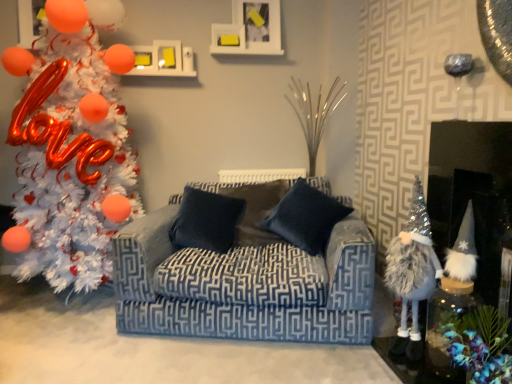
Question: Does dark blue fabric pillow at center, positioned as the 2th pillow in left-to-right order, have a greater width compared to dark blue fabric pillow at center, the second pillow viewed from the right?

Choices:
 (A) no
 (B) yes

Answer: (B)

Question: Is dark blue fabric pillow at center, the second pillow viewed from the right, located within dark blue fabric pillow at center, positioned as the 2th pillow in left-to-right order?

Choices:
 (A) no
 (B) yes

Answer: (A)

Question: Can you see dark blue fabric pillow at center, positioned as the 2th pillow in left-to-right order, touching dark blue fabric pillow at center, marked as the first pillow in a left-to-right arrangement?

Choices:
 (A) no
 (B) yes

Answer: (A)

Question: From the image's perspective, is dark blue fabric pillow at center, which appears as the 1th pillow when viewed from the right, under dark blue fabric pillow at center, the second pillow viewed from the right?

Choices:
 (A) yes
 (B) no

Answer: (B)

Question: Considering the relative sizes of dark blue fabric pillow at center, which appears as the 1th pillow when viewed from the right, and dark blue fabric pillow at center, the second pillow viewed from the right, in the image provided, is dark blue fabric pillow at center, which appears as the 1th pillow when viewed from the right, thinner than dark blue fabric pillow at center, the second pillow viewed from the right,?

Choices:
 (A) no
 (B) yes

Answer: (A)

Question: Is dark blue fabric pillow at center, positioned as the 2th pillow in left-to-right order, wider or thinner than white fluffy gnome at lower right?

Choices:
 (A) thin
 (B) wide

Answer: (A)

Question: Is dark blue fabric pillow at center, which appears as the 1th pillow when viewed from the right, inside the boundaries of white fluffy gnome at lower right, or outside?

Choices:
 (A) inside
 (B) outside

Answer: (B)

Question: Is point (288, 203) closer or farther from the camera than point (476, 380)?

Choices:
 (A) closer
 (B) farther

Answer: (B)

Question: From the image's perspective, is dark blue fabric pillow at center, which appears as the 1th pillow when viewed from the right, positioned above or below white fluffy gnome at lower right?

Choices:
 (A) above
 (B) below

Answer: (A)

Question: From a real-world perspective, is white fluffy gnome at lower right above or below velvet blue couch at center?

Choices:
 (A) above
 (B) below

Answer: (B)

Question: Based on their positions, is white fluffy gnome at lower right located to the left or right of velvet blue couch at center?

Choices:
 (A) right
 (B) left

Answer: (A)

Question: From the image's perspective, is white fluffy gnome at lower right above or below velvet blue couch at center?

Choices:
 (A) below
 (B) above

Answer: (A)

Question: From their relative heights in the image, would you say white fluffy gnome at lower right is taller or shorter than velvet blue couch at center?

Choices:
 (A) short
 (B) tall

Answer: (A)

Question: From the image's perspective, is white tinsel christmas tree at left positioned above or below fuzzy silver gnome at right, which ranks as the second toy in right-to-left order?

Choices:
 (A) below
 (B) above

Answer: (B)

Question: In terms of size, does white tinsel christmas tree at left appear bigger or smaller than fuzzy silver gnome at right, which is the first toy in left-to-right order?

Choices:
 (A) big
 (B) small

Answer: (A)